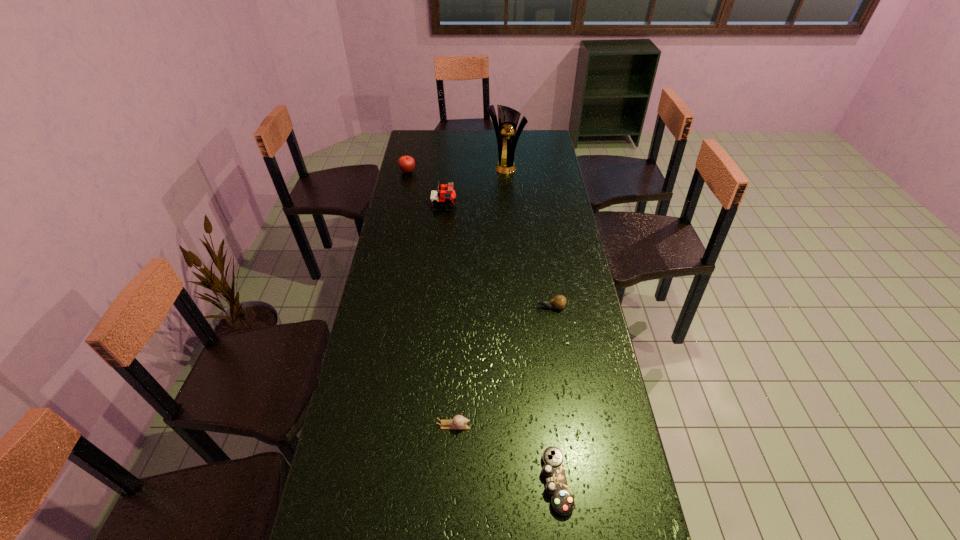
You are a GUI agent. You are given a task and a screenshot of the screen. Output one action in this format:
    pyautogui.click(x=<x>, y=<y>)
    Task: Click on the control
    This screenshot has height=540, width=960.
    Given the screenshot: What is the action you would take?
    pyautogui.click(x=562, y=502)

Locate an element on the screen. vacant area situated at the front of the tallest object, where the globe is visible is located at coordinates (507, 179).

Image resolution: width=960 pixels, height=540 pixels. Identify the location of vacant space located 0.080m on the front-facing side of the fifth shortest object. (474, 205).

Identify the location of vacant position located on the back of the apple. The image size is (960, 540). (414, 144).

You are a GUI agent. You are given a task and a screenshot of the screen. Output one action in this format:
    pyautogui.click(x=<x>, y=<y>)
    Task: Click on the blank space located 0.140m on the front-facing side of the fourth tallest object
    The image size is (960, 540).
    Given the screenshot: What is the action you would take?
    pyautogui.click(x=495, y=307)

This screenshot has height=540, width=960. I want to click on vacant space situated on the front-facing side of the fourth tallest object, so click(x=472, y=307).

The height and width of the screenshot is (540, 960). Find the location of `vacant region located on the front-facing side of the fourth tallest object`. vacant region located on the front-facing side of the fourth tallest object is located at coordinates (449, 307).

Locate an element on the screen. Image resolution: width=960 pixels, height=540 pixels. vacant area situated on the shell of the second nearest object is located at coordinates (564, 426).

The image size is (960, 540). In order to click on free space located on the left of the control in this screenshot , I will do `click(463, 482)`.

Identify the location of object that is at the left edge. (406, 163).